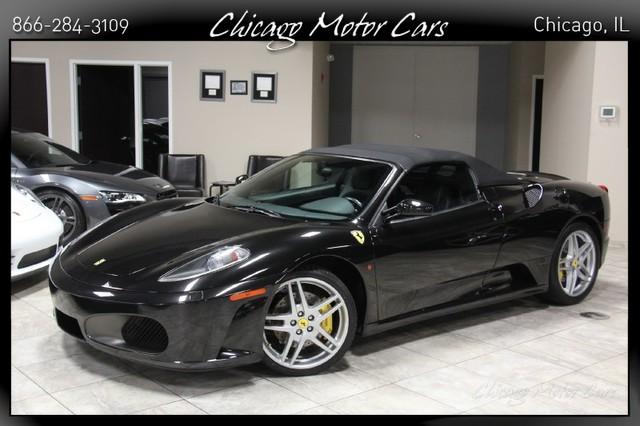
Find the location of a particular element. This screenshot has width=640, height=426. chair is located at coordinates (185, 163), (258, 159).